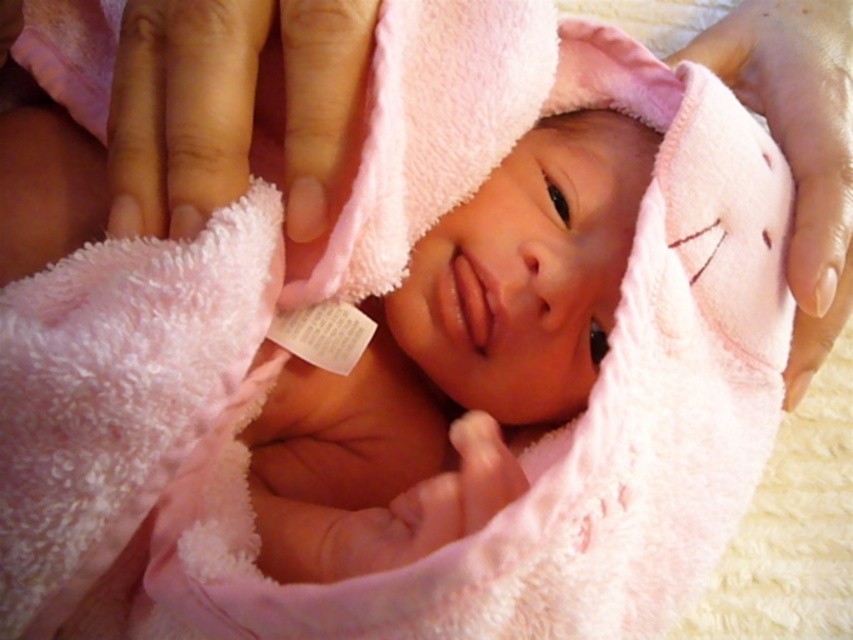
Question: Which of the following is the farthest from the observer?

Choices:
 (A) (846, 244)
 (B) (218, 179)

Answer: (A)

Question: Which point is farther from the camera taking this photo?

Choices:
 (A) (129, 51)
 (B) (842, 36)

Answer: (B)

Question: Where is smooth pink towel at upper left located in relation to pink soft towel at upper center in the image?

Choices:
 (A) left
 (B) right

Answer: (A)

Question: Which point is farther to the camera?

Choices:
 (A) pink soft towel at upper center
 (B) smooth pink towel at upper left

Answer: (A)

Question: Can you confirm if smooth pink towel at upper left is thinner than pink soft towel at upper center?

Choices:
 (A) no
 (B) yes

Answer: (B)

Question: Does smooth pink towel at upper left come behind pink soft towel at upper center?

Choices:
 (A) no
 (B) yes

Answer: (A)